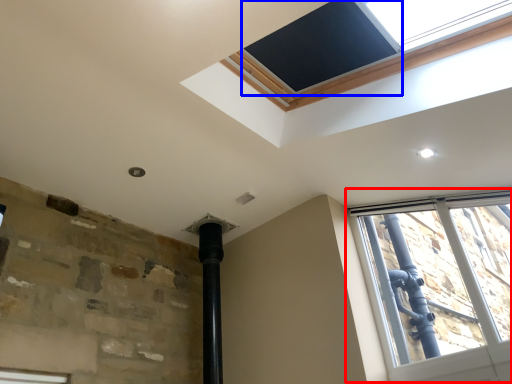
Question: Which object appears closest to the camera in this image, window (highlighted by a red box) or window screen (highlighted by a blue box)?

Choices:
 (A) window
 (B) window screen

Answer: (B)